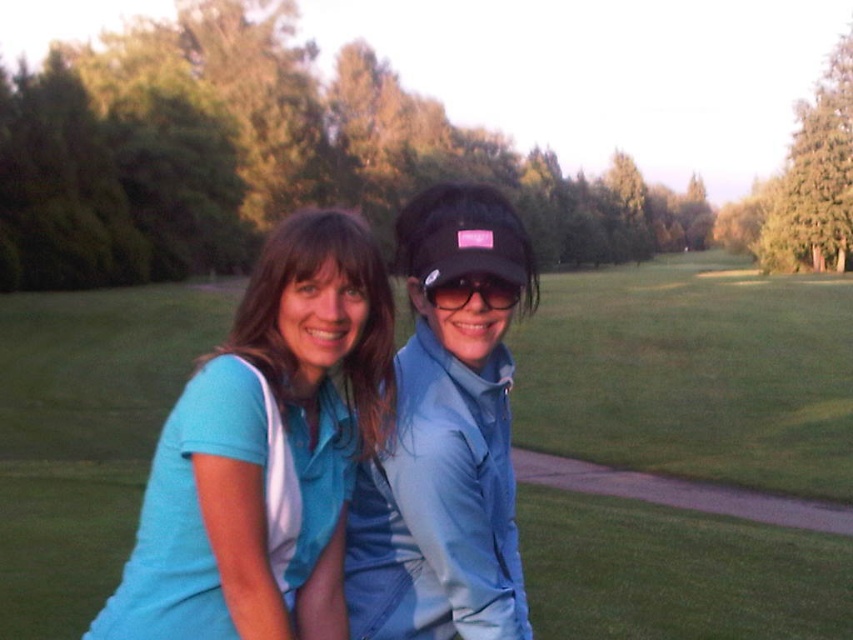
Who is more distant from viewer, (625, 573) or (323, 586)?

Positioned behind is point (625, 573).

Is green grass at center below matte blue shirt at center?

Actually, green grass at center is above matte blue shirt at center.

Is point (172, 289) behind point (364, 397)?

Yes, it is behind point (364, 397).

Where is `green grass at center`? This screenshot has width=853, height=640. green grass at center is located at coordinates (693, 372).

Can you confirm if matte blue shirt at center is wider than matte blue jacket at center?

Incorrect, matte blue shirt at center's width does not surpass matte blue jacket at center's.

What do you see at coordinates (265, 451) in the screenshot? The width and height of the screenshot is (853, 640). I see `matte blue shirt at center` at bounding box center [265, 451].

Which is behind, point (117, 602) or point (515, 269)?

Point (515, 269)

Image resolution: width=853 pixels, height=640 pixels. I want to click on matte blue shirt at center, so click(265, 451).

Measure the distance between point (39, 401) and camera.

Point (39, 401) is 19.53 meters from camera.

Can you confirm if green grass at center is bigger than black matte sunglasses at center?

Yes.

Identify the location of green grass at center. The image size is (853, 640). (693, 372).